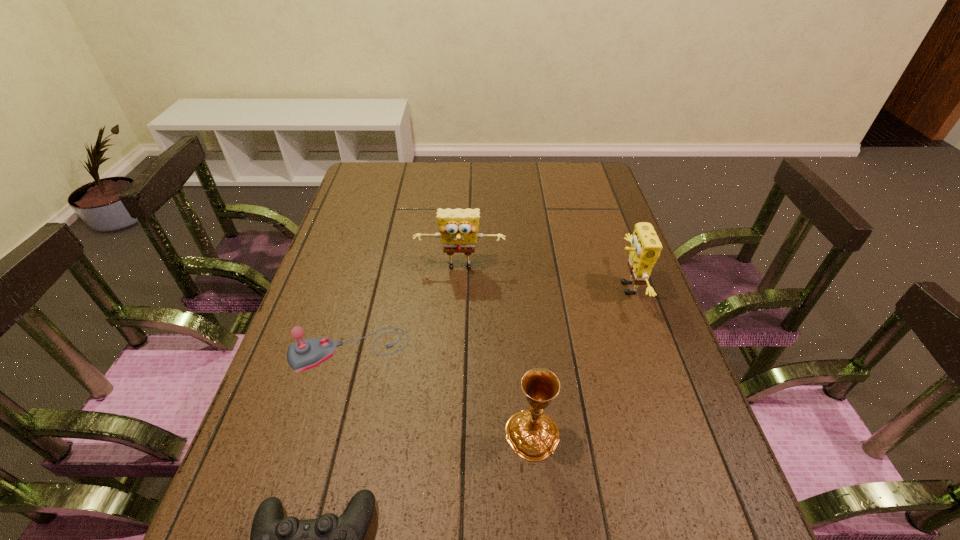
You are a GUI agent. You are given a task and a screenshot of the screen. Output one action in this format:
    pyautogui.click(x=<x>, y=<y>)
    Task: Click on the blank region between the fourth farthest object and the right sponge
    
    Given the screenshot: What is the action you would take?
    pyautogui.click(x=580, y=361)

Find the location of a particular element. vacant area that lies between the chalice and the left sponge is located at coordinates (496, 352).

The image size is (960, 540). What are the coordinates of `unoccupied position between the left sponge and the second nearest object` in the screenshot? It's located at (496, 352).

I want to click on free space between the left sponge and the third nearest object, so click(405, 309).

The image size is (960, 540). Identify the location of free space between the fourth tallest object and the left sponge. (405, 309).

Locate an element on the screen. Image resolution: width=960 pixels, height=540 pixels. the closest object to the left sponge is located at coordinates (x=302, y=355).

The width and height of the screenshot is (960, 540). I want to click on object that is the second closest one to the rightmost object, so click(533, 435).

In order to click on vacant point that satisfies the following two spatial constraints: 1. on the front side of the second nearest object; 2. on the right side of the joystick in this screenshot , I will do `click(326, 435)`.